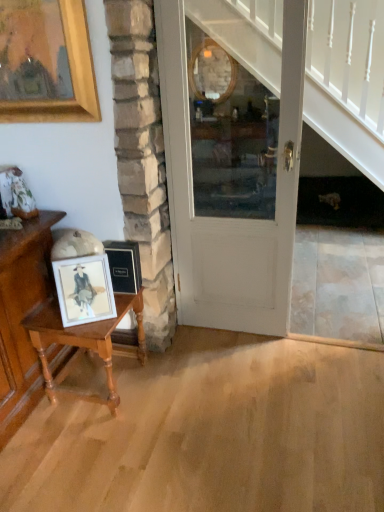
Find the location of `white painted wood door at center`. white painted wood door at center is located at coordinates (230, 219).

Locate an element on the screen. This screenshot has width=384, height=512. matte wooden picture frame at left is located at coordinates (84, 289).

Considering the sizes of objects matte wooden picture frame at left and white painted wood door at center in the image provided, who is taller, matte wooden picture frame at left or white painted wood door at center?

With more height is white painted wood door at center.

Where is `picture frame below the white painted wood door at center (from a real-world perspective)`? The height and width of the screenshot is (512, 384). picture frame below the white painted wood door at center (from a real-world perspective) is located at coordinates pyautogui.click(x=84, y=289).

Is matte wooden picture frame at left far from white painted wood door at center?

matte wooden picture frame at left is near white painted wood door at center, not far away.

Based on the photo, considering their positions, is matte wooden picture frame at left located in front of or behind white painted wood door at center?

In the image, matte wooden picture frame at left appears behind white painted wood door at center.

Is white painted wood door at center not within wooden table at left?

white painted wood door at center is positioned outside wooden table at left.

Is white painted wood door at center not near wooden table at left?

That's not correct — white painted wood door at center is a little close to wooden table at left.

Does white painted wood door at center turn towards wooden table at left?

No, white painted wood door at center does not turn towards wooden table at left.

Considering the sizes of objects white painted wood door at center and wooden table at left in the image provided, who is smaller, white painted wood door at center or wooden table at left?

With smaller size is wooden table at left.

How far apart are white painted wood door at center and matte wooden picture frame at left?

The distance of white painted wood door at center from matte wooden picture frame at left is 72.60 centimeters.

Would you say white painted wood door at center is a long distance from matte wooden picture frame at left?

No, white painted wood door at center is not far away from matte wooden picture frame at left.

Considering the relative positions of white painted wood door at center and matte wooden picture frame at left in the image provided, is white painted wood door at center to the right of matte wooden picture frame at left from the viewer's perspective?

Yes, white painted wood door at center is to the right of matte wooden picture frame at left.

In terms of width, does white painted wood door at center look wider or thinner when compared to matte wooden picture frame at left?

Considering their sizes, white painted wood door at center looks broader than matte wooden picture frame at left.

Is wooden table at left outside of white painted wood door at center?

Yes, wooden table at left is not within white painted wood door at center.

From a real-world perspective, does wooden table at left stand above white painted wood door at center?

No.

The height and width of the screenshot is (512, 384). There is a wooden table at left. Find the location of `door above it (from a real-world perspective)`. door above it (from a real-world perspective) is located at coordinates (230, 219).

Is matte wooden picture frame at left positioned far away from wooden table at left?

No, matte wooden picture frame at left is in close proximity to wooden table at left.

Does matte wooden picture frame at left appear on the right side of wooden table at left?

Indeed, matte wooden picture frame at left is positioned on the right side of wooden table at left.

From the image's perspective, is matte wooden picture frame at left over wooden table at left?

Yes, from the image's perspective, matte wooden picture frame at left is on top of wooden table at left.

Is wooden table at left completely or partially inside matte wooden picture frame at left?

No, wooden table at left is not surrounded by matte wooden picture frame at left.

Who is taller, wooden table at left or matte wooden picture frame at left?

wooden table at left.

From a real-world perspective, who is located higher, wooden table at left or matte wooden picture frame at left?

From a 3D spatial view, matte wooden picture frame at left is above.

You are a GUI agent. You are given a task and a screenshot of the screen. Output one action in this format:
    pyautogui.click(x=<x>, y=<y>)
    Task: Click on the door to the right of matte wooden picture frame at left
    This screenshot has width=384, height=512.
    Given the screenshot: What is the action you would take?
    pyautogui.click(x=230, y=219)

Locate an element on the screen. Image resolution: width=384 pixels, height=512 pixels. table located underneath the white painted wood door at center (from a real-world perspective) is located at coordinates point(84,344).

When comparing their distances from matte wooden picture frame at left, does white painted wood door at center or wooden table at left seem closer?

The object closer to matte wooden picture frame at left is wooden table at left.

Consider the image. Based on their spatial positions, is white painted wood door at center or matte wooden picture frame at left closer to wooden table at left?

Among the two, matte wooden picture frame at left is located nearer to wooden table at left.

Which object lies further to the anchor point white painted wood door at center, wooden table at left or matte wooden picture frame at left?

matte wooden picture frame at left.

When comparing their distances from white painted wood door at center, does matte wooden picture frame at left or wooden table at left seem closer?

The object closer to white painted wood door at center is wooden table at left.

Estimate the real-world distances between objects in this image. Which object is closer to wooden table at left, matte wooden picture frame at left or white painted wood door at center?

matte wooden picture frame at left lies closer to wooden table at left than the other object.

Based on their spatial positions, is wooden table at left or white painted wood door at center further from matte wooden picture frame at left?

Among the two, white painted wood door at center is located further to matte wooden picture frame at left.

The image size is (384, 512). What are the coordinates of `picture frame between wooden table at left and white painted wood door at center` in the screenshot? It's located at (84, 289).